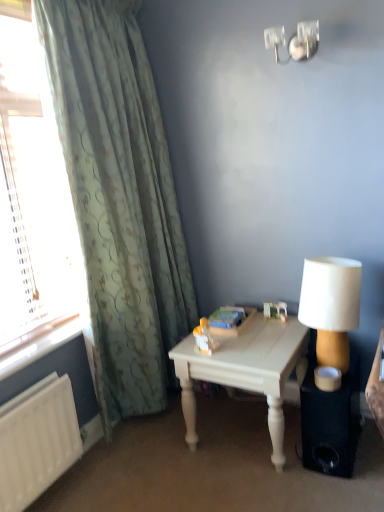
Where is `vacant area that lies between green textured curtain at left and white painted wood table at center`? vacant area that lies between green textured curtain at left and white painted wood table at center is located at coordinates (182, 444).